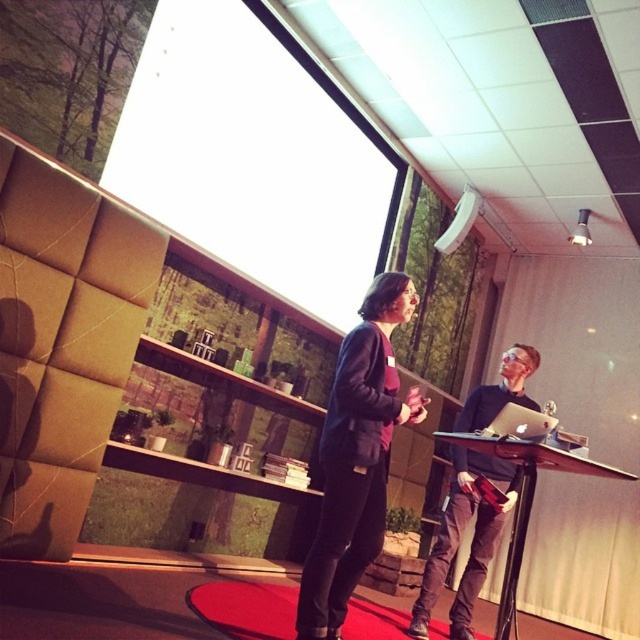
Measure the distance from matte black jacket at center to black glossy table at center.

A distance of 28.41 inches exists between matte black jacket at center and black glossy table at center.

From the picture: Does matte black jacket at center appear on the right side of black glossy table at center?

Incorrect, matte black jacket at center is not on the right side of black glossy table at center.

Is point (355, 573) in front of point (520, 513)?

Yes, point (355, 573) is closer to viewer.

I want to click on matte black jacket at center, so click(x=356, y=456).

Can you confirm if white glossy projection screen at upper center is positioned below black glossy table at center?

Incorrect, white glossy projection screen at upper center is not positioned below black glossy table at center.

The width and height of the screenshot is (640, 640). What do you see at coordinates (250, 157) in the screenshot?
I see `white glossy projection screen at upper center` at bounding box center [250, 157].

Find the location of a particular element. The image size is (640, 640). white glossy projection screen at upper center is located at coordinates (250, 157).

Which of these two, white glossy projection screen at upper center or matte black jacket at center, stands shorter?

matte black jacket at center is shorter.

Is point (166, 56) positioned in front of point (337, 388)?

No, (166, 56) is behind (337, 388).

Find the location of a particular element. white glossy projection screen at upper center is located at coordinates coord(250,157).